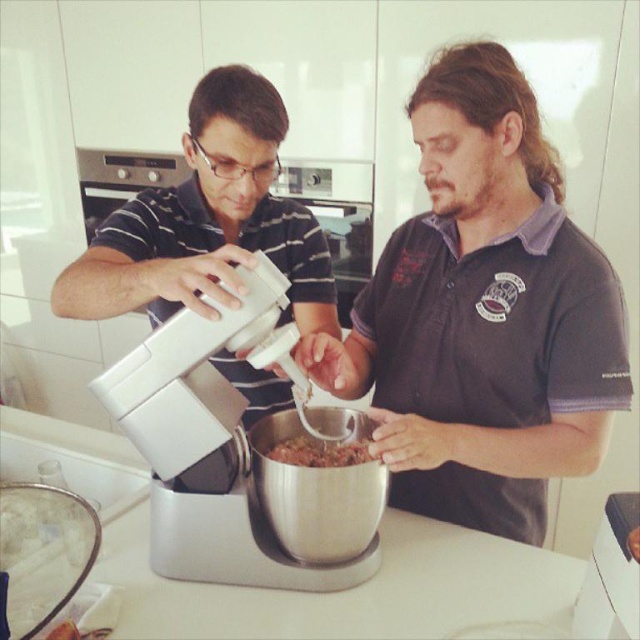
Where is `silver metallic mixer at center`? This screenshot has height=640, width=640. silver metallic mixer at center is located at coordinates (241, 460).

Between silver metallic mixer at center and white matte mixer at center, which one appears on the left side from the viewer's perspective?

From the viewer's perspective, white matte mixer at center appears more on the left side.

The image size is (640, 640). What are the coordinates of `silver metallic mixer at center` in the screenshot? It's located at (241, 460).

In the scene shown: Does silver metallic mixer at center have a larger size compared to brown crumbly mixture at center?

Yes.

Between silver metallic mixer at center and brown crumbly mixture at center, which one is positioned lower?

Positioned lower is silver metallic mixer at center.

The width and height of the screenshot is (640, 640). What do you see at coordinates (241, 460) in the screenshot? I see `silver metallic mixer at center` at bounding box center [241, 460].

You are a GUI agent. You are given a task and a screenshot of the screen. Output one action in this format:
    pyautogui.click(x=<x>, y=<y>)
    Task: Click on the silver metallic mixer at center
    The image size is (640, 640).
    Given the screenshot: What is the action you would take?
    pyautogui.click(x=241, y=460)

Between dark gray shirt at center and silver metallic mixer at center, which one has more height?

dark gray shirt at center is taller.

Can you confirm if dark gray shirt at center is positioned to the right of silver metallic mixer at center?

Indeed, dark gray shirt at center is positioned on the right side of silver metallic mixer at center.

Is point (419, 438) positioned after point (276, 310)?

Yes.

At what (x,y) coordinates should I click in order to perform the action: click on dark gray shirt at center. Please return your answer as a coordinate pair (x, y). Looking at the image, I should click on (483, 314).